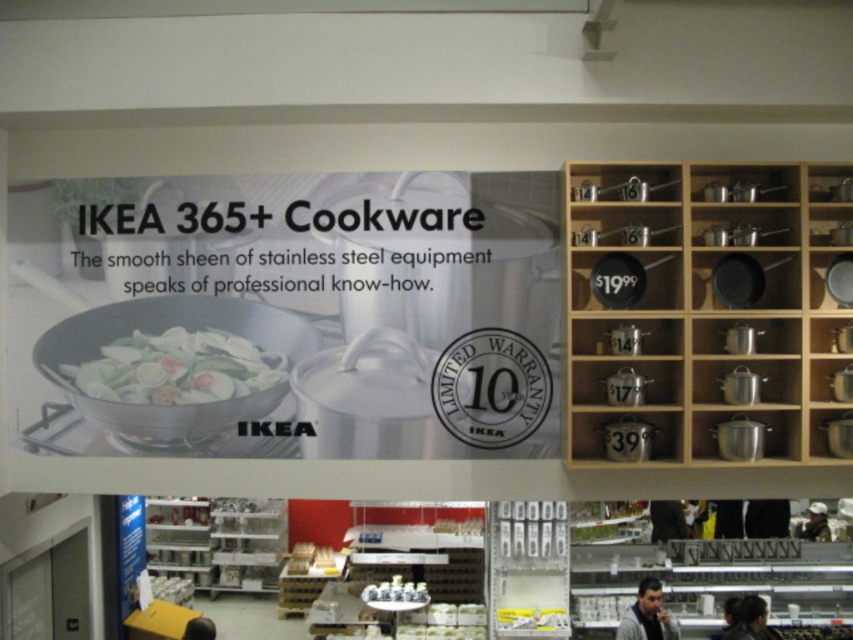
How distant is green matte vegetables at center from white glossy salt shaker at center?

green matte vegetables at center and white glossy salt shaker at center are 3.37 meters apart from each other.

Locate an element on the screen. This screenshot has width=853, height=640. green matte vegetables at center is located at coordinates (175, 369).